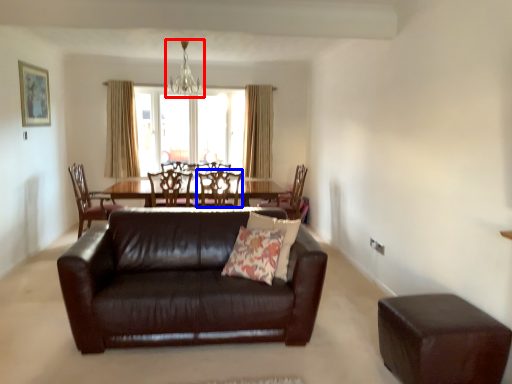
Question: Which object is closer to the camera taking this photo, light fixture (highlighted by a red box) or chair (highlighted by a blue box)?

Choices:
 (A) light fixture
 (B) chair

Answer: (B)